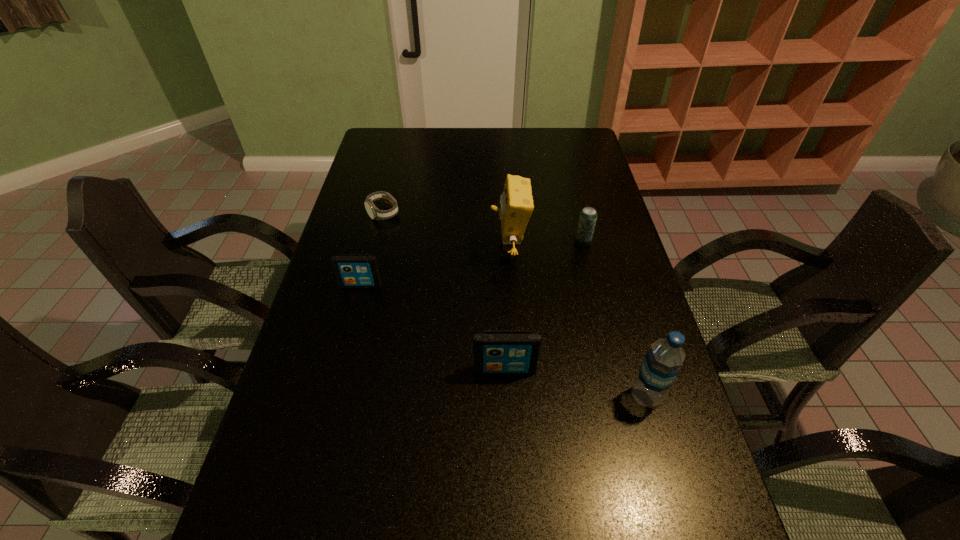
At what (x,y) coordinates should I click in order to perform the action: click on beer can situated at the right edge. Please return your answer as a coordinate pair (x, y). Image resolution: width=960 pixels, height=540 pixels. Looking at the image, I should click on (588, 216).

Find the location of a particular element. water bottle located at the right edge is located at coordinates (662, 362).

Locate an element on the screen. Image resolution: width=960 pixels, height=540 pixels. free location at the far edge is located at coordinates (434, 140).

The image size is (960, 540). In the image, there is a desktop. Identify the location of blank space at the left edge. (286, 390).

The height and width of the screenshot is (540, 960). I want to click on free spot at the right edge of the desktop, so click(626, 324).

In the image, there is a desktop. In order to click on vacant space at the far left corner in this screenshot , I will do `click(398, 151)`.

At what (x,y) coordinates should I click in order to perform the action: click on vacant space that is in between the left iPod and the beer can. Please return your answer as a coordinate pair (x, y). The image size is (960, 540). Looking at the image, I should click on (472, 264).

This screenshot has width=960, height=540. In order to click on free space that is in between the sponge and the water bottle in this screenshot , I will do `click(577, 323)`.

Where is `empty location between the left iPod and the watch`? The width and height of the screenshot is (960, 540). empty location between the left iPod and the watch is located at coordinates (372, 249).

The image size is (960, 540). Identify the location of free space between the sponge and the water bottle. (577, 323).